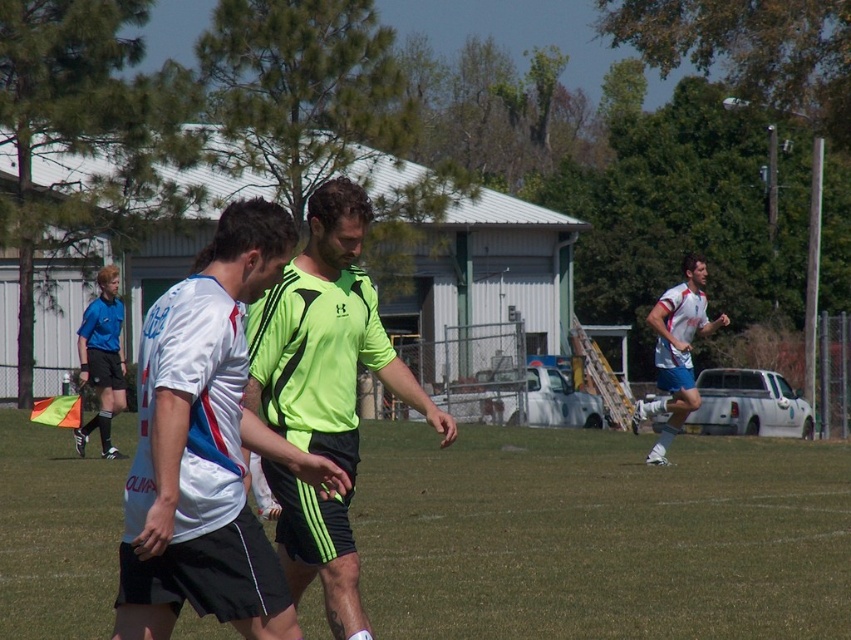
Consider the image. Between green grass football field at center and white matte soccer player at right, which one appears on the left side from the viewer's perspective?

green grass football field at center

Does green grass football field at center appear on the right side of white matte soccer player at right?

In fact, green grass football field at center is to the left of white matte soccer player at right.

Does point (415, 458) come farther from viewer compared to point (667, 435)?

Yes, point (415, 458) is behind point (667, 435).

You are a GUI agent. You are given a task and a screenshot of the screen. Output one action in this format:
    pyautogui.click(x=<x>, y=<y>)
    Task: Click on the green grass football field at center
    This screenshot has height=640, width=851.
    Given the screenshot: What is the action you would take?
    point(600,536)

Does white matte jersey at center appear over white matte soccer player at right?

Yes.

Consider the image. Is the position of white matte jersey at center more distant than that of white matte soccer player at right?

No, white matte jersey at center is in front of white matte soccer player at right.

Does point (166, 586) come closer to viewer compared to point (711, 323)?

Yes, it is in front of point (711, 323).

Find the location of `white matte jersey at center`. white matte jersey at center is located at coordinates 207,448.

From the picture: Who is positioned more to the right, green grass football field at center or white matte jersey at center?

green grass football field at center

Locate an element on the screen. green grass football field at center is located at coordinates (600, 536).

Describe the element at coordinates (600, 536) in the screenshot. I see `green grass football field at center` at that location.

What are the coordinates of `green grass football field at center` in the screenshot? It's located at (600, 536).